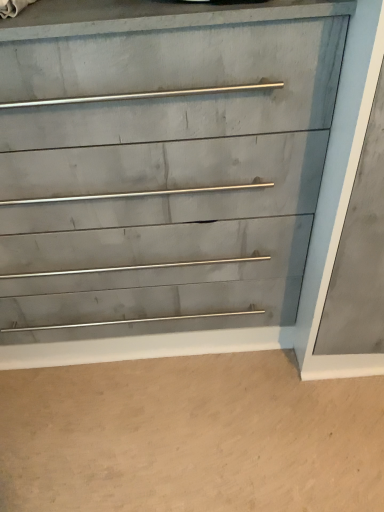
Identify the location of matte gray dresser at center. (309, 247).

This screenshot has height=512, width=384. Describe the element at coordinates (309, 247) in the screenshot. I see `matte gray dresser at center` at that location.

Locate an element on the screen. The image size is (384, 512). matte gray dresser at center is located at coordinates (309, 247).